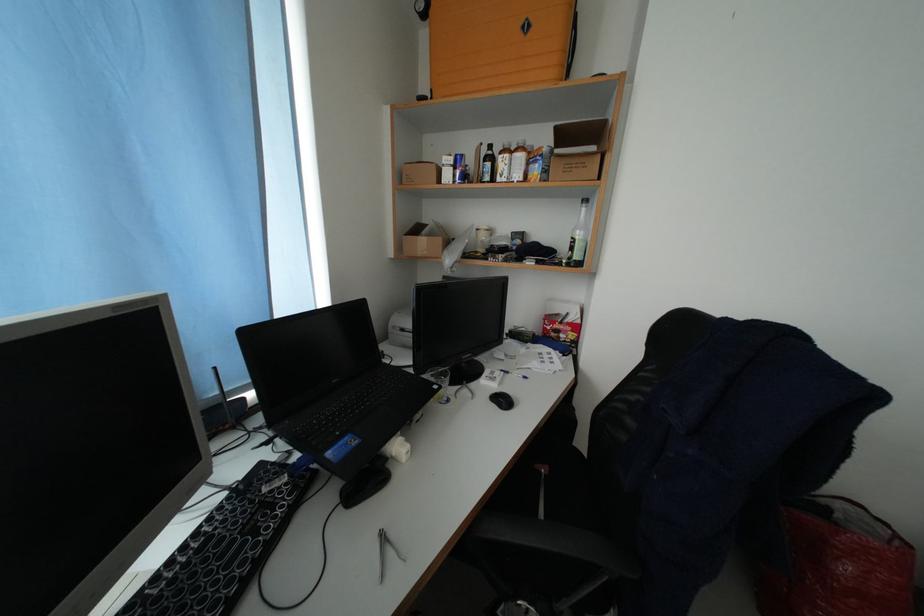
Find where to sit the chair sitting surface. Please return your answer as a coordinate pair (x, y).

(557, 500)